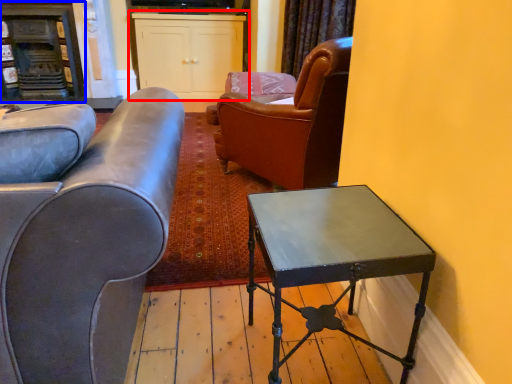
Question: Among these objects, which one is nearest to the camera, cabinetry (highlighted by a red box) or fireplace (highlighted by a blue box)?

Choices:
 (A) cabinetry
 (B) fireplace

Answer: (B)